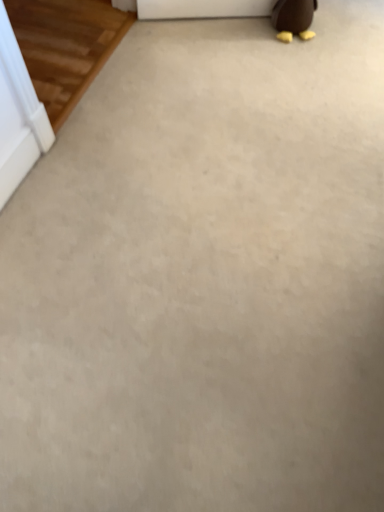
Where is `free space that is to the left of brown matte penguin at upper right`? free space that is to the left of brown matte penguin at upper right is located at coordinates (251, 35).